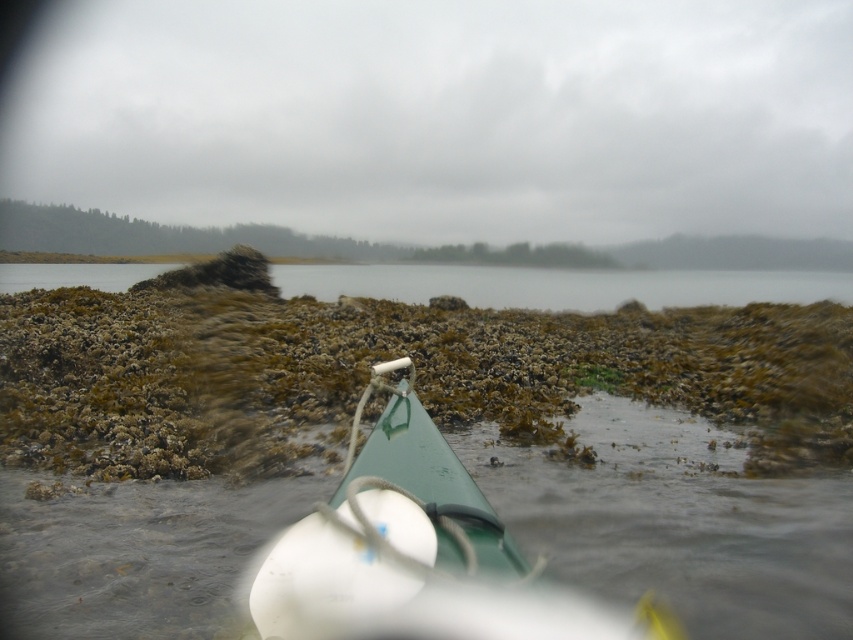
You are in a kayak and need to navigate between two points marked in the image. The first point is at coordinate point[328,282] and the second is at point[372,280]. Which point is closer to your current position in the kayak?

Point[328,282] is closer to the camera than point[372,280], so the first point is closer to your current position in the kayak.